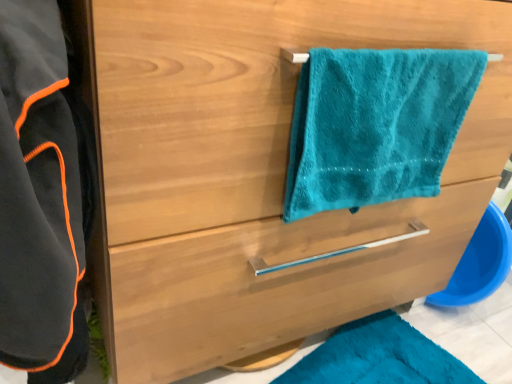
Where is `teal plush towel at upper right`? teal plush towel at upper right is located at coordinates (375, 125).

What is the approximate width of satin wood drawer at center?

satin wood drawer at center is 15.52 inches in width.

Locate an element on the screen. The height and width of the screenshot is (384, 512). teal plush towel at upper right is located at coordinates (375, 125).

From the image's perspective, which is above, black fleece bathrobe at left or satin wood drawer at center?

black fleece bathrobe at left, from the image's perspective.

Is black fleece bathrobe at left with satin wood drawer at center?

black fleece bathrobe at left and satin wood drawer at center are not in contact.

Considering the sizes of objects black fleece bathrobe at left and satin wood drawer at center in the image provided, who is shorter, black fleece bathrobe at left or satin wood drawer at center?

Standing shorter between the two is satin wood drawer at center.

Between black fleece bathrobe at left and satin wood drawer at center, which one has smaller width?

With smaller width is black fleece bathrobe at left.

What's the angular difference between teal plush towel at upper right and satin wood drawer at center's facing directions?

They differ by 0.378 degrees in their facing directions.

Looking at this image, which object is further away from the camera, teal plush towel at upper right or satin wood drawer at center?

satin wood drawer at center is behind.

Which of these two, teal plush towel at upper right or satin wood drawer at center, is bigger?

satin wood drawer at center is bigger.

Looking at this image, is satin wood drawer at center positioned in front of black fleece bathrobe at left?

No, it is not.

From the image's perspective, which one is positioned higher, satin wood drawer at center or black fleece bathrobe at left?

black fleece bathrobe at left, from the image's perspective.

Can you confirm if satin wood drawer at center is smaller than black fleece bathrobe at left?

Indeed, satin wood drawer at center has a smaller size compared to black fleece bathrobe at left.

Looking at this image, from a real-world perspective, is satin wood drawer at center over black fleece bathrobe at left?

No.

Between black fleece bathrobe at left and teal plush towel at upper right, which one appears on the right side from the viewer's perspective?

teal plush towel at upper right.

Consider the image. Is black fleece bathrobe at left surrounding teal plush towel at upper right?

That's incorrect, teal plush towel at upper right is not inside black fleece bathrobe at left.

Which is less distant, (57, 191) or (385, 148)?

The point (57, 191) is more forward.

Looking at their sizes, would you say black fleece bathrobe at left is wider or thinner than teal plush towel at upper right?

Considering their sizes, black fleece bathrobe at left looks broader than teal plush towel at upper right.

From the image's perspective, does satin wood drawer at center appear higher than teal plush towel at upper right?

No, from the image's perspective, satin wood drawer at center is not on top of teal plush towel at upper right.

Which is more to the left, satin wood drawer at center or teal plush towel at upper right?

teal plush towel at upper right is more to the left.

Which of these two, satin wood drawer at center or teal plush towel at upper right, is wider?

Wider between the two is satin wood drawer at center.

How many degrees apart are the facing directions of satin wood drawer at center and teal plush towel at upper right?

They differ by 0.378 degrees in their facing directions.

From a real-world perspective, does teal plush towel at upper right stand above black fleece bathrobe at left?

Correct, in the physical world, teal plush towel at upper right is higher than black fleece bathrobe at left.

Is point (441, 57) less distant than point (48, 207)?

No, (441, 57) is behind (48, 207).

In the image, is teal plush towel at upper right positioned in front of or behind black fleece bathrobe at left?

Visually, teal plush towel at upper right is located behind black fleece bathrobe at left.

You are a GUI agent. You are given a task and a screenshot of the screen. Output one action in this format:
    pyautogui.click(x=<x>, y=<y>)
    Task: Click on the bathrobe positioned vertically above the satin wood drawer at center (from a real-world perspective)
    Image resolution: width=512 pixels, height=384 pixels.
    Given the screenshot: What is the action you would take?
    pyautogui.click(x=39, y=199)

The width and height of the screenshot is (512, 384). Identify the location of drawer behind the teal plush towel at upper right. (277, 280).

Estimate the real-world distances between objects in this image. Which object is further from satin wood drawer at center, teal plush towel at upper right or black fleece bathrobe at left?

black fleece bathrobe at left.

Estimate the real-world distances between objects in this image. Which object is further from black fleece bathrobe at left, satin wood drawer at center or teal plush towel at upper right?

teal plush towel at upper right is further to black fleece bathrobe at left.

Estimate the real-world distances between objects in this image. Which object is further from teal plush towel at upper right, satin wood drawer at center or black fleece bathrobe at left?

black fleece bathrobe at left.

When comparing their distances from black fleece bathrobe at left, does teal plush towel at upper right or satin wood drawer at center seem further?

teal plush towel at upper right lies further to black fleece bathrobe at left than the other object.

From the image, which object appears to be nearer to satin wood drawer at center, black fleece bathrobe at left or teal plush towel at upper right?

Among the two, teal plush towel at upper right is located nearer to satin wood drawer at center.

When comparing their distances from teal plush towel at upper right, does black fleece bathrobe at left or satin wood drawer at center seem closer?

Based on the image, satin wood drawer at center appears to be nearer to teal plush towel at upper right.

Where is `towel/napkin between black fleece bathrobe at left and satin wood drawer at center in the horizontal direction`? towel/napkin between black fleece bathrobe at left and satin wood drawer at center in the horizontal direction is located at coordinates [375, 125].